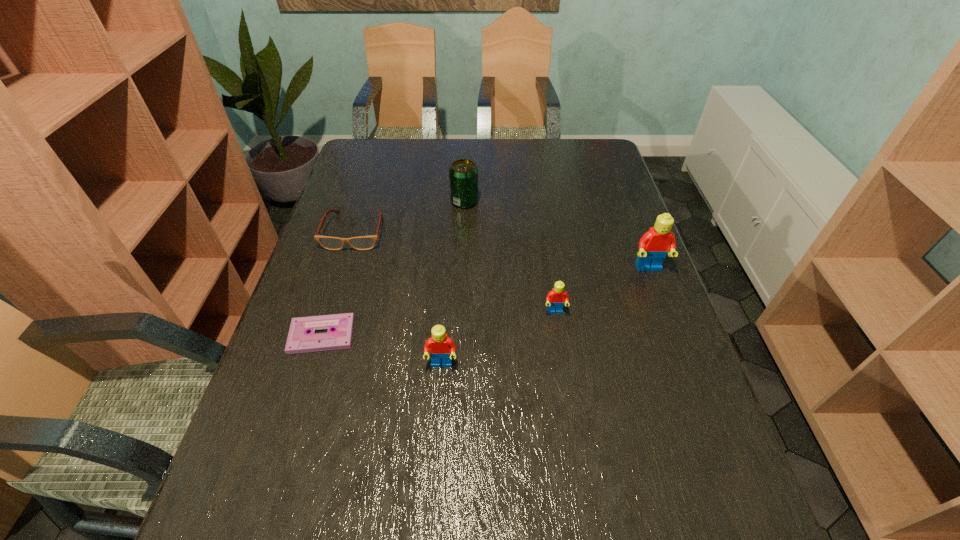
Where is `vacant area at the left edge of the desktop`? vacant area at the left edge of the desktop is located at coordinates (379, 176).

This screenshot has height=540, width=960. Find the location of `vacant space at the right edge of the desktop`. vacant space at the right edge of the desktop is located at coordinates (711, 429).

This screenshot has width=960, height=540. I want to click on vacant space at the far right corner of the desktop, so click(x=565, y=148).

The height and width of the screenshot is (540, 960). I want to click on vacant area at the near right corner of the desktop, so click(x=707, y=482).

The height and width of the screenshot is (540, 960). Identify the location of free spot between the videotape and the farthest object. 394,268.

Where is `vacant space in between the videotape and the leftmost Lego`? vacant space in between the videotape and the leftmost Lego is located at coordinates (382, 350).

Find the location of `free area in between the leftmost Lego and the rightmost object`. free area in between the leftmost Lego and the rightmost object is located at coordinates (545, 316).

Identify the location of free space between the farthest object and the second shortest Lego. This screenshot has height=540, width=960. tap(453, 283).

This screenshot has height=540, width=960. Identify the location of free space that is in between the tallest Lego and the beer can. (557, 235).

The image size is (960, 540). Find the location of `free space between the fifth nearest object and the farthest Lego`. free space between the fifth nearest object and the farthest Lego is located at coordinates click(502, 250).